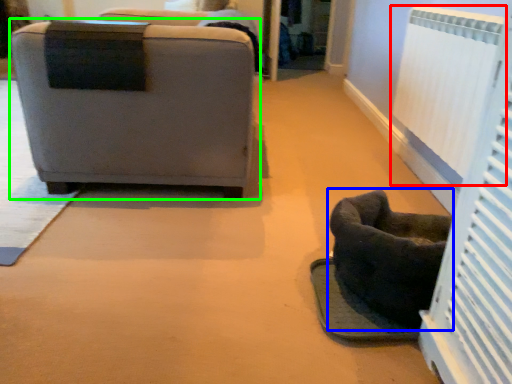
Question: Based on their relative distances, which object is nearer to radiator (highlighted by a red box)? Choose from furniture (highlighted by a blue box) and chair (highlighted by a green box).

Choices:
 (A) furniture
 (B) chair

Answer: (A)